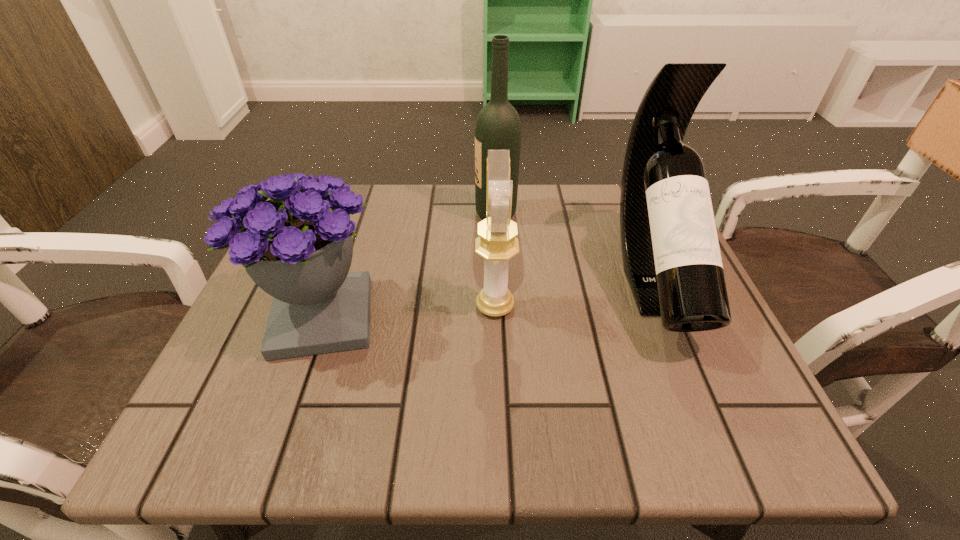
Where is `free spot located on the front-facing side of the award`? The image size is (960, 540). free spot located on the front-facing side of the award is located at coordinates (390, 306).

Where is `vacant space positioned 0.250m on the back of the bouquet`? The width and height of the screenshot is (960, 540). vacant space positioned 0.250m on the back of the bouquet is located at coordinates (361, 205).

This screenshot has width=960, height=540. Identify the location of object at the left edge. (297, 247).

This screenshot has width=960, height=540. Find the location of `object that is at the right edge`. object that is at the right edge is located at coordinates (671, 257).

Identify the location of object situated at the far right corner. Image resolution: width=960 pixels, height=540 pixels. (671, 257).

In the image, there is a desktop. Where is `vacant space at the far edge`? Image resolution: width=960 pixels, height=540 pixels. vacant space at the far edge is located at coordinates (594, 226).

Find the location of a particular element. Image resolution: width=960 pixels, height=540 pixels. free space at the near edge is located at coordinates [445, 430].

In the image, there is a desktop. Where is `vacant area at the left edge`? The image size is (960, 540). vacant area at the left edge is located at coordinates (260, 319).

The image size is (960, 540). Identify the location of free space at the right edge. (643, 357).

Image resolution: width=960 pixels, height=540 pixels. In the image, there is a desktop. In order to click on free region at the near left corner in this screenshot , I will do `click(237, 416)`.